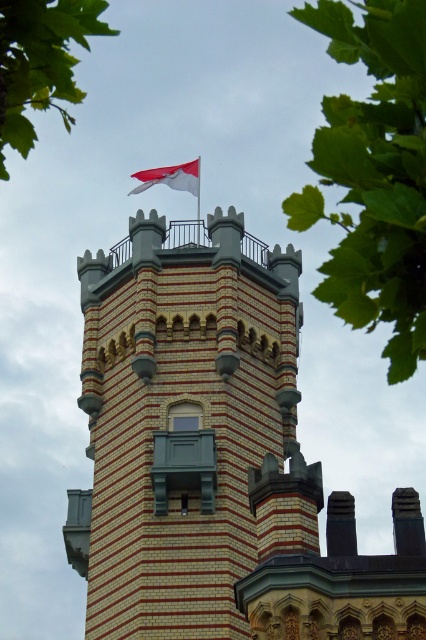
You are standing at the base of the tower and want to place a decorative light exactly at the point marked by coordinates point (187, 428). Based on the scene description, where on the brick tower at center should you position the light?

The point (187, 428) corresponds to the brick tower at center, so you should position the light on the brick tower at center.

You are standing at the coordinates 0.5, 0.5 in the image. Which direction should you move to reach the brick tower at center?

The brick tower at center is located at point [187,428]. Since you are at [213,320], you should move northeast to reach it.

You are standing in front of the tower described in the scene. There is a specific point marked at coordinates [187,428]. What architectural feature can be found at this point?

At point [187,428] lies brick tower at center.